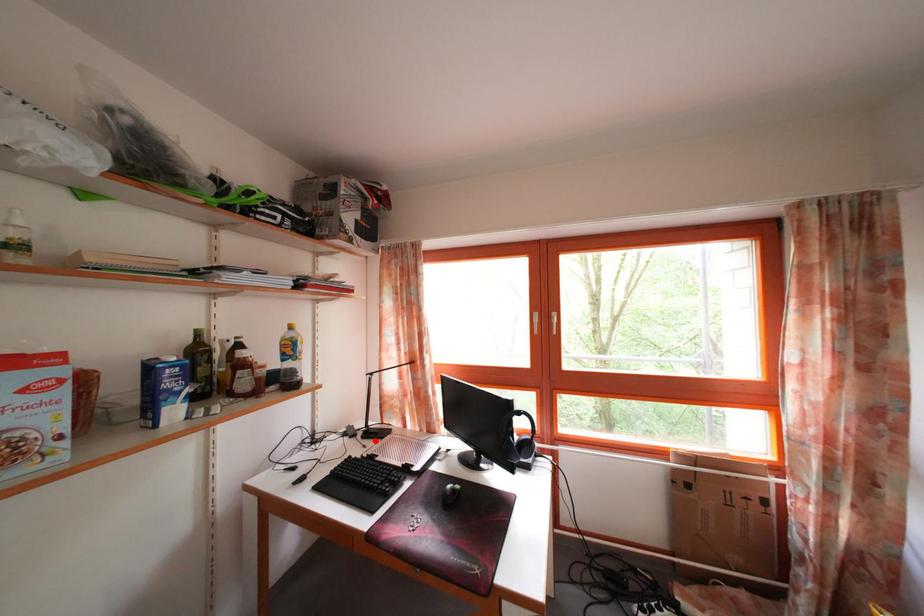
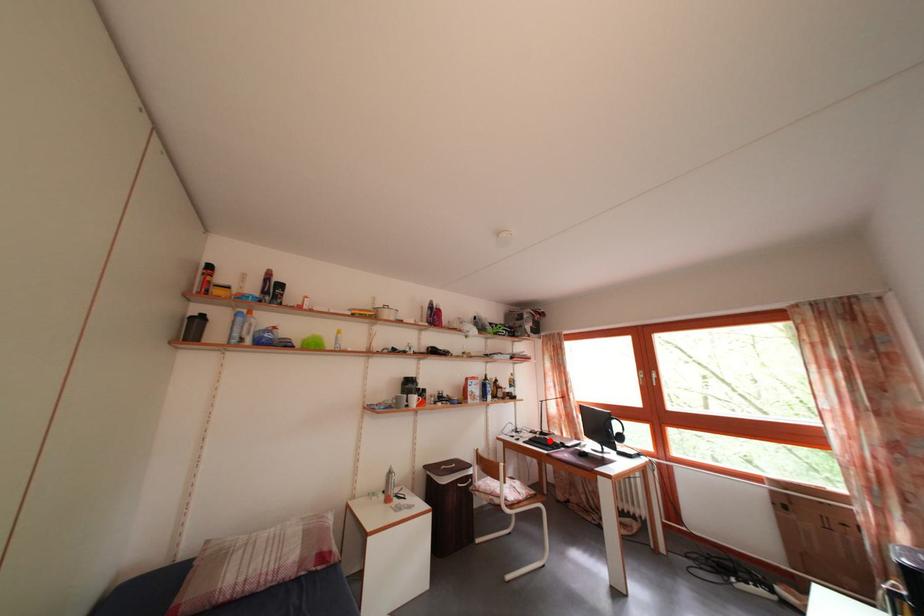
Consider the image. I am providing you with two images of the same scene from different viewpoints. A red point is marked on the first image and another point is marked on the second image. Is the red point in image1 aligned with the point shown in image2?

Yes